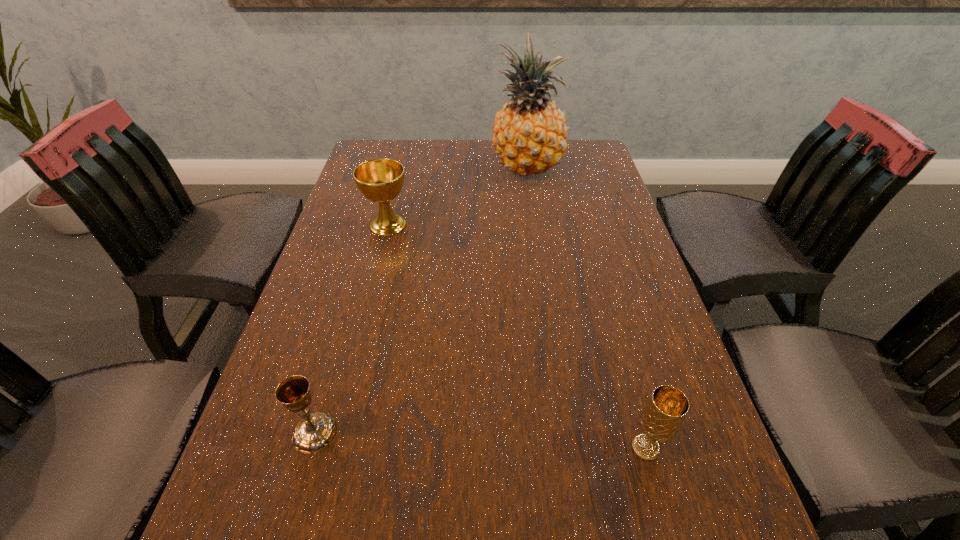
Where is `the farthest object`? The width and height of the screenshot is (960, 540). the farthest object is located at coordinates (529, 135).

The width and height of the screenshot is (960, 540). What are the coordinates of `the tallest object` in the screenshot? It's located at (529, 135).

This screenshot has height=540, width=960. I want to click on the third nearest object, so click(380, 180).

Locate an element on the screen. the rightmost chalice is located at coordinates (665, 411).

The image size is (960, 540). In order to click on blank area located on the left of the farthest object in this screenshot , I will do `click(406, 168)`.

Where is `free space located 0.400m on the right of the farthest chalice`? Image resolution: width=960 pixels, height=540 pixels. free space located 0.400m on the right of the farthest chalice is located at coordinates (562, 224).

I want to click on free space located on the left of the rightmost chalice, so click(574, 448).

In order to click on object that is at the far edge in this screenshot , I will do `click(529, 135)`.

I want to click on pineapple present at the right edge, so click(x=529, y=135).

Where is `chalice positioned at the right edge`? The image size is (960, 540). chalice positioned at the right edge is located at coordinates (665, 411).